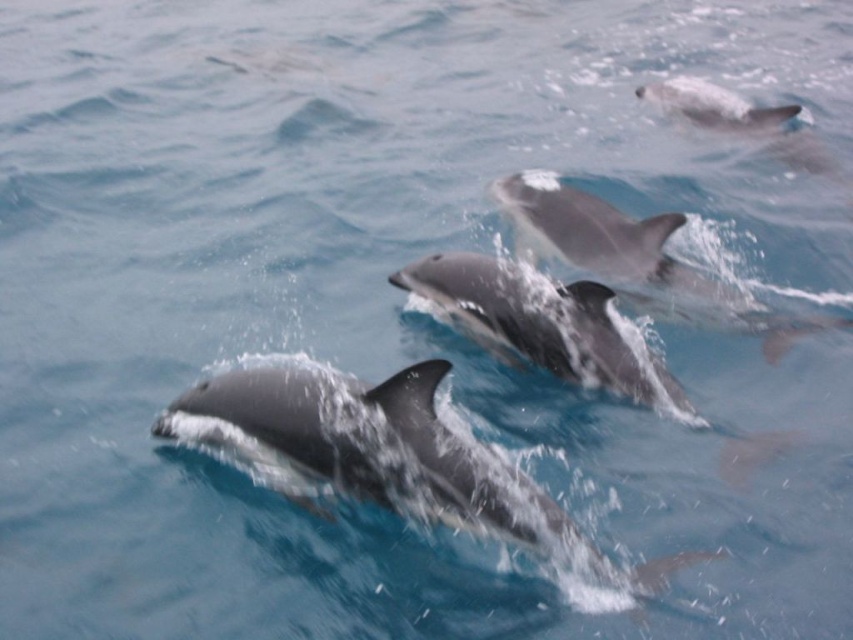
Who is shorter, smooth gray dolphin at center or glossy gray dolphin at center?

glossy gray dolphin at center

Is smooth gray dolphin at center closer to camera compared to glossy gray dolphin at center?

Yes, it is.

Does point (494, 518) come closer to viewer compared to point (514, 216)?

Yes, it is.

You are a GUI agent. You are given a task and a screenshot of the screen. Output one action in this format:
    pyautogui.click(x=<x>, y=<y>)
    Task: Click on the smooth gray dolphin at center
    This screenshot has width=853, height=640.
    Given the screenshot: What is the action you would take?
    pyautogui.click(x=368, y=444)

The image size is (853, 640). I want to click on smooth gray dolphin at center, so click(368, 444).

Does point (283, 454) lie behind point (706, 106)?

No, (283, 454) is in front of (706, 106).

Does point (699, 557) come farther from viewer compared to point (672, 86)?

No, (699, 557) is closer to viewer.

The width and height of the screenshot is (853, 640). Identify the location of smooth gray dolphin at center. (368, 444).

In the scene shown: Is glossy gray dolphin at center bigger than smooth gray dolphin at upper right?

Indeed, glossy gray dolphin at center has a larger size compared to smooth gray dolphin at upper right.

Between point (546, 240) and point (722, 108), which one is positioned behind?

Point (722, 108)

What do you see at coordinates (593, 230) in the screenshot?
I see `glossy gray dolphin at center` at bounding box center [593, 230].

The width and height of the screenshot is (853, 640). I want to click on glossy gray dolphin at center, so click(593, 230).